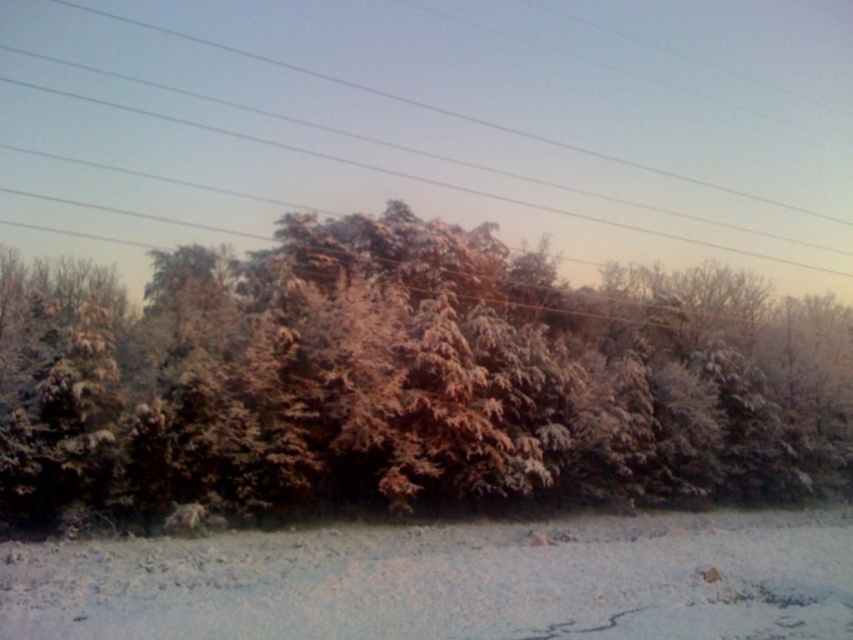
Is white frosty trees at center wider than smooth wire at upper center?

No, white frosty trees at center is not wider than smooth wire at upper center.

Who is taller, white frosty trees at center or smooth wire at upper center?

smooth wire at upper center is taller.

What do you see at coordinates (393, 384) in the screenshot? I see `white frosty trees at center` at bounding box center [393, 384].

Where is `white frosty trees at center`? The image size is (853, 640). white frosty trees at center is located at coordinates (393, 384).